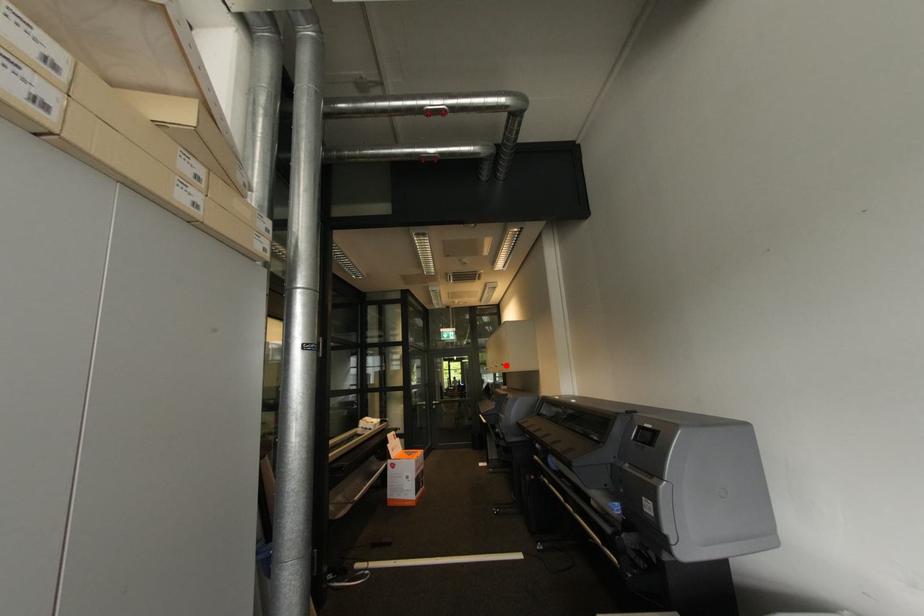
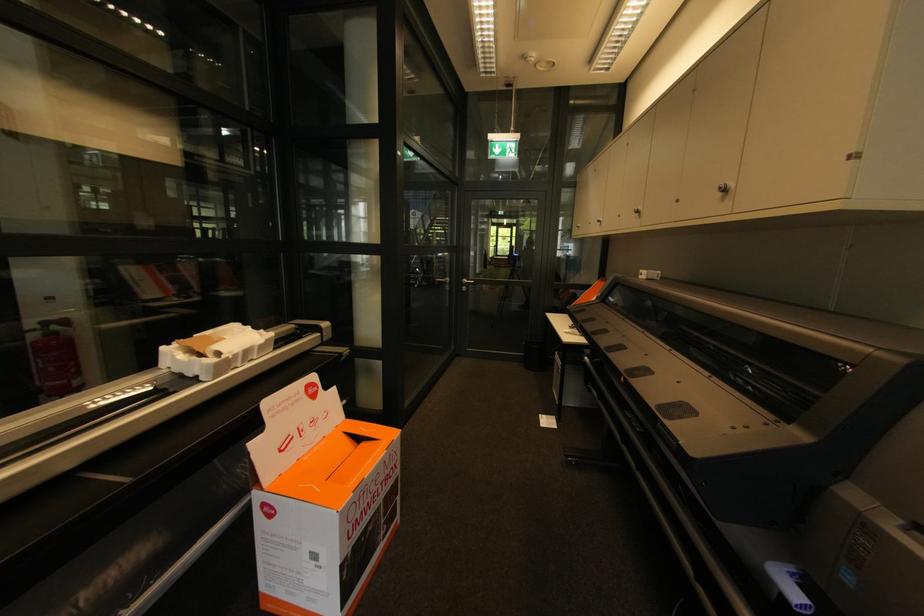
Question: I am providing you with two images of the same scene from different viewpoints. Image1 has a red point marked. In image2, the corresponding 3D location appears at what relative position? Reply with the corresponding letter.

Choices:
 (A) Closer
 (B) Farther

Answer: (A)